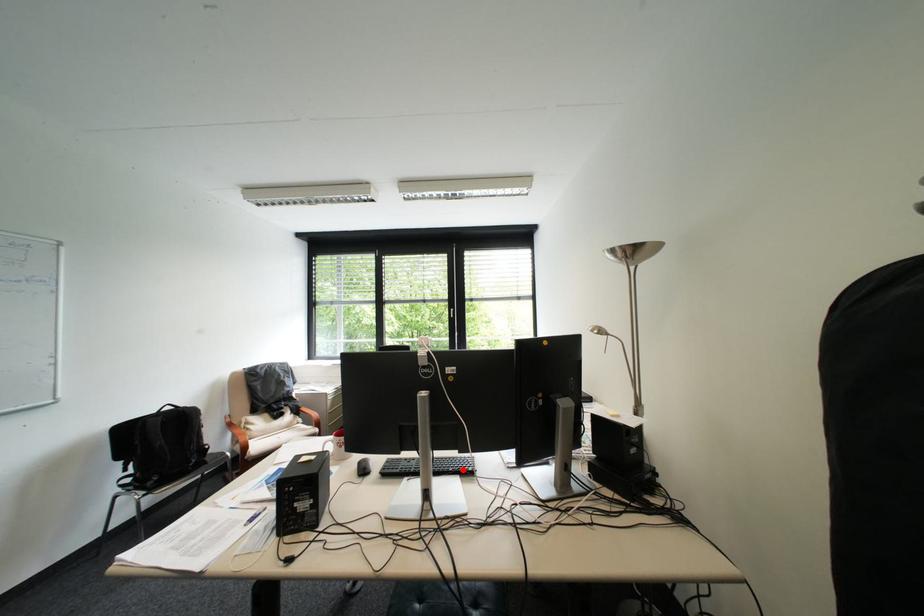
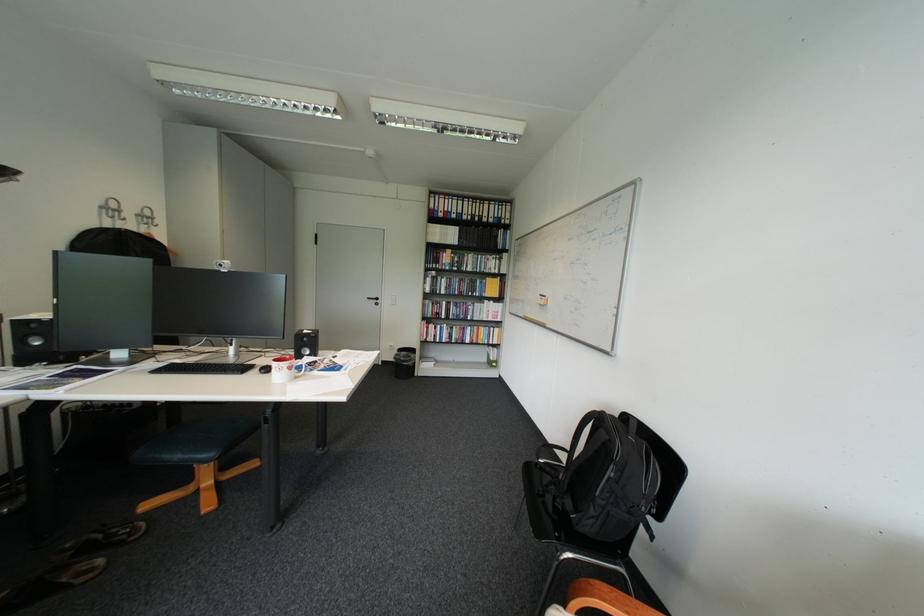
Question: I am providing you with two images of the same scene from different viewpoints. A red point is marked on the first image. At the location where the point appears in image 1, is it still visible in image 2?

Choices:
 (A) Yes
 (B) No

Answer: (A)